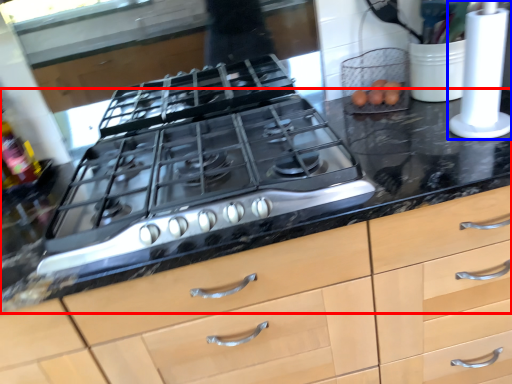
Question: Which object appears farthest to the camera in this image, countertop (highlighted by a red box) or kitchen appliance (highlighted by a blue box)?

Choices:
 (A) countertop
 (B) kitchen appliance

Answer: (B)